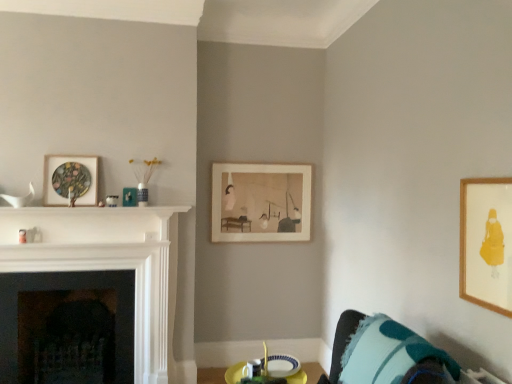
Question: From the image's perspective, is wooden framed print at upper right, the 3th picture frame positioned from the left, beneath white glossy fireplace at left, which ranks as the 1th fireplace in front-to-back order?

Choices:
 (A) yes
 (B) no

Answer: (B)

Question: Is wooden framed print at upper right, which is counted as the first picture frame, starting from the right, touching white glossy fireplace at left, which ranks as the 1th fireplace in front-to-back order?

Choices:
 (A) no
 (B) yes

Answer: (A)

Question: Considering the relative sizes of wooden framed print at upper right, which is the third picture frame from back to front, and white glossy fireplace at left, which is counted as the 2th fireplace, starting from the back, in the image provided, is wooden framed print at upper right, which is the third picture frame from back to front, wider than white glossy fireplace at left, which is counted as the 2th fireplace, starting from the back,?

Choices:
 (A) no
 (B) yes

Answer: (A)

Question: From the image's perspective, is wooden framed print at upper right, which is the third picture frame from back to front, on white glossy fireplace at left, which is counted as the 2th fireplace, starting from the back?

Choices:
 (A) no
 (B) yes

Answer: (B)

Question: Is wooden framed print at upper right, the 3th picture frame positioned from the left, to the right of white glossy fireplace at left, which is counted as the 2th fireplace, starting from the back, from the viewer's perspective?

Choices:
 (A) no
 (B) yes

Answer: (B)

Question: In the image, is teal fabric pillow at lower right on the left side or the right side of wooden framed print at upper right, which is the third picture frame from back to front?

Choices:
 (A) left
 (B) right

Answer: (A)

Question: Is teal fabric pillow at lower right bigger or smaller than wooden framed print at upper right, which is the third picture frame from back to front?

Choices:
 (A) big
 (B) small

Answer: (A)

Question: Is teal fabric pillow at lower right in front of or behind wooden framed print at upper right, the 3th picture frame positioned from the left, in the image?

Choices:
 (A) front
 (B) behind

Answer: (A)

Question: In terms of height, does teal fabric pillow at lower right look taller or shorter compared to wooden framed print at upper right, the 3th picture frame positioned from the left?

Choices:
 (A) tall
 (B) short

Answer: (B)

Question: Considering the positions of point (61, 193) and point (73, 291), is point (61, 193) closer or farther from the camera than point (73, 291)?

Choices:
 (A) farther
 (B) closer

Answer: (B)

Question: From their relative heights in the image, would you say matte wooden picture frame at upper left, placed as the second picture frame when sorted from back to front, is taller or shorter than black stone fireplace at left, placed as the 2th fireplace when sorted from front to back?

Choices:
 (A) tall
 (B) short

Answer: (B)

Question: In terms of size, does matte wooden picture frame at upper left, acting as the third picture frame starting from the right, appear bigger or smaller than black stone fireplace at left, the first fireplace when ordered from back to front?

Choices:
 (A) big
 (B) small

Answer: (B)

Question: Is matte wooden picture frame at upper left, arranged as the 2th picture frame when viewed from the front, in front of or behind black stone fireplace at left, placed as the 2th fireplace when sorted from front to back, in the image?

Choices:
 (A) behind
 (B) front

Answer: (A)

Question: Looking at the image, does white glossy fireplace at left, which ranks as the 1th fireplace in front-to-back order, seem bigger or smaller compared to black stone fireplace at left, placed as the 2th fireplace when sorted from front to back?

Choices:
 (A) small
 (B) big

Answer: (A)

Question: Relative to black stone fireplace at left, placed as the 2th fireplace when sorted from front to back, is white glossy fireplace at left, which ranks as the 1th fireplace in front-to-back order, in front or behind?

Choices:
 (A) front
 (B) behind

Answer: (A)